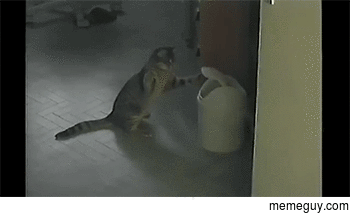
Where is `trash can`? This screenshot has width=350, height=215. trash can is located at coordinates (226, 128).